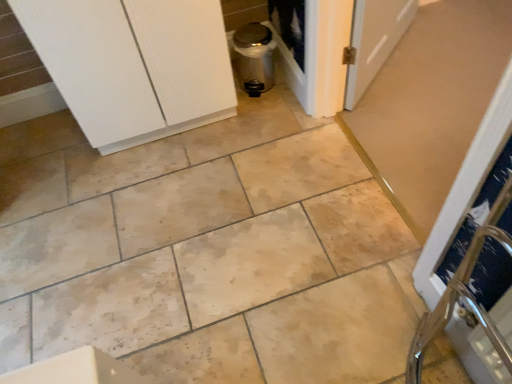
Question: From a real-world perspective, is satin silver trash can at center above or below metallic silver screen door at center?

Choices:
 (A) below
 (B) above

Answer: (B)

Question: Is satin silver trash can at center taller or shorter than metallic silver screen door at center?

Choices:
 (A) short
 (B) tall

Answer: (B)

Question: Estimate the real-world distances between objects in this image. Which object is closer to the metallic silver screen door at center?

Choices:
 (A) white textured cabinet at upper left
 (B) satin silver trash can at center

Answer: (B)

Question: Estimate the real-world distances between objects in this image. Which object is farther from the satin silver trash can at center?

Choices:
 (A) metallic silver screen door at center
 (B) white textured cabinet at upper left

Answer: (B)